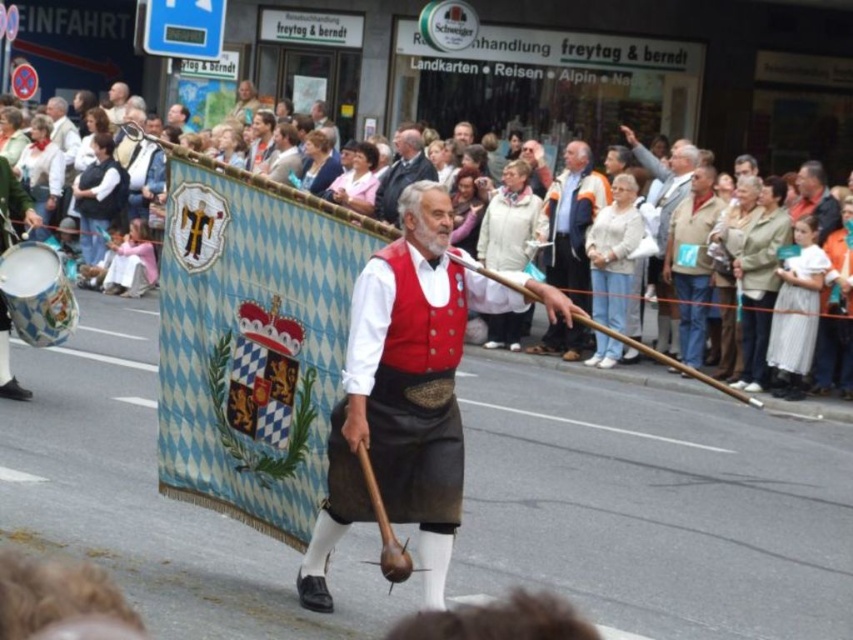
You are a photographer trying to capture the Bavarian parade scene. You notice the red jacket at center and the red velvet vest at center. Which one should you focus on if you want to photograph the item that is positioned to the right?

The red jacket at center is to the right of the red velvet vest at center, so you should focus on the red jacket at center.

You are a photographer positioned at the front of the parade. You want to capture both the matte red vest at center and the red jacket at center in your photo. Which one will appear larger in the photo?

The matte red vest at center will appear larger in the photo because it is closer to the viewer than the red jacket at center.

You are a photographer trying to capture the man in traditional Bavarian attire. You notice the matte red vest at center and the red jacket at center. Which one is located to the left of the other?

The matte red vest at center is positioned on the left side of red jacket at center.